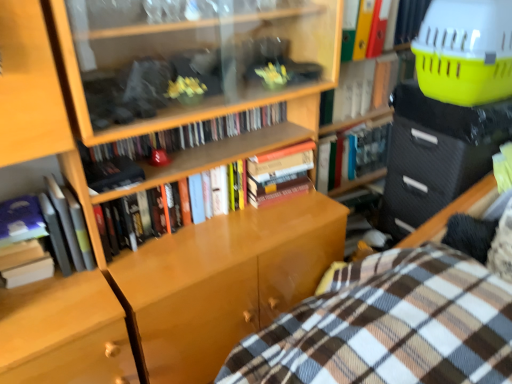
Question: In terms of height, does matte black bookshelf at upper center, positioned as the 5th book in right-to-left order, look taller or shorter compared to hardcover book at upper center, positioned as the 2th book in right-to-left order?

Choices:
 (A) tall
 (B) short

Answer: (B)

Question: From the image's perspective, is matte black bookshelf at upper center, positioned as the 5th book in right-to-left order, above or below hardcover book at upper center, positioned as the 2th book in right-to-left order?

Choices:
 (A) below
 (B) above

Answer: (A)

Question: Considering the real-world distances, which object is closest to the plaid fabric bed at lower right?

Choices:
 (A) hardcover book at center, which appears as the third book when viewed from the left
 (B) yellow plastic basket at upper right
 (C) black textured drawer at right
 (D) hardcover book at left, acting as the first book starting from the left
 (E) hardcover book at left, acting as the 7th book starting from the right

Answer: (C)

Question: Estimate the real-world distances between objects in this image. Which object is farther from the hardcover book at left, the eighth book from the right?

Choices:
 (A) hardcover book at left, acting as the 7th book starting from the right
 (B) hardcover book at upper center, the seventh book in the left-to-right sequence
 (C) hardcover book at center, which appears as the third book when viewed from the left
 (D) hardcover books at center, the fifth book positioned from the left
 (E) hardcover book at center, positioned as the sixth book in left-to-right order

Answer: (B)